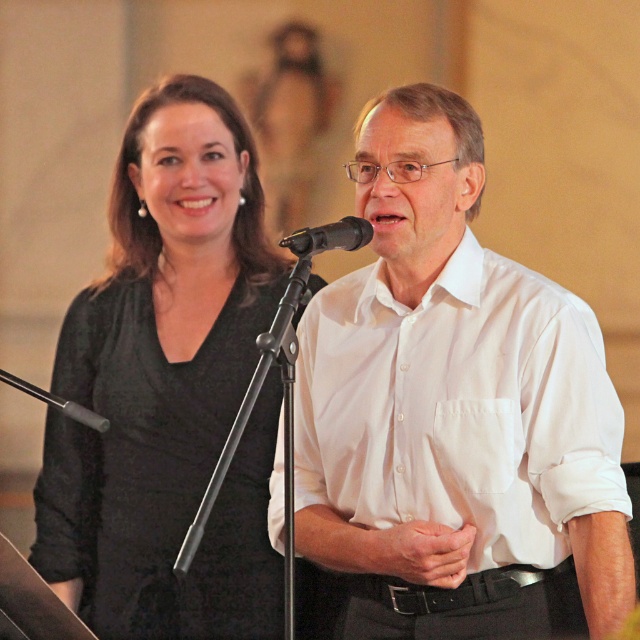
Question: Estimate the real-world distances between objects in this image. Which object is farther from the black matte dress at left?

Choices:
 (A) black matte microphone at center
 (B) white matte shirt at center

Answer: (A)

Question: Is white matte shirt at center closer to camera compared to black matte dress at left?

Choices:
 (A) yes
 (B) no

Answer: (A)

Question: Can you confirm if black matte dress at left is positioned to the left of black matte microphone at center?

Choices:
 (A) no
 (B) yes

Answer: (B)

Question: Which object is closer to the camera taking this photo?

Choices:
 (A) black matte microphone at center
 (B) black matte dress at left

Answer: (A)

Question: Does white matte shirt at center appear under black matte microphone at center?

Choices:
 (A) yes
 (B) no

Answer: (A)

Question: Among these objects, which one is farthest from the camera?

Choices:
 (A) white matte shirt at center
 (B) black matte microphone at center
 (C) black matte dress at left

Answer: (C)